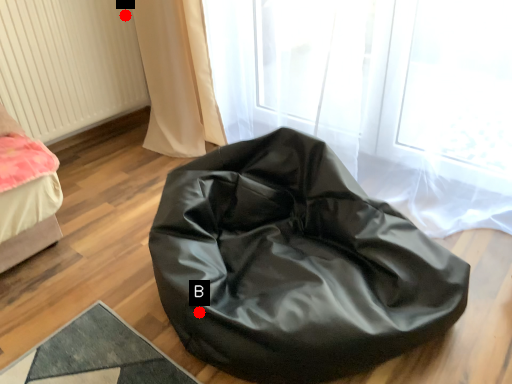
Question: Two points are circled on the image, labeled by A and B beside each circle. Which point is closer to the camera?

Choices:
 (A) A is closer
 (B) B is closer

Answer: (B)